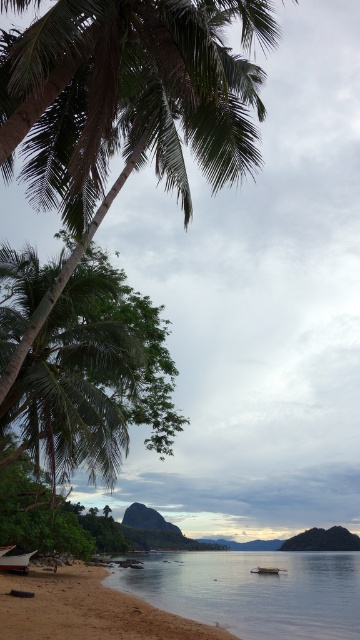
Can you confirm if clear water at lower center is positioned above brown sandy beach at lower left?

No.

What are the coordinates of `clear water at lower center` in the screenshot? It's located at [253, 589].

Locate an element on the screen. clear water at lower center is located at coordinates (253, 589).

Who is positioned more to the left, brown sandy beach at lower left or wooden boat at lower center?

From the viewer's perspective, brown sandy beach at lower left appears more on the left side.

Is the position of brown sandy beach at lower left more distant than that of wooden boat at lower center?

That is False.

Between point (86, 589) and point (267, 570), which one is positioned behind?

The point (267, 570) is more distant.

Find the location of a particular element. The width and height of the screenshot is (360, 640). brown sandy beach at lower left is located at coordinates [87, 609].

From the picture: Is clear water at lower center further to the viewer compared to wooden boat at lower left?

No, clear water at lower center is in front of wooden boat at lower left.

Is clear water at lower center smaller than wooden boat at lower left?

Incorrect, clear water at lower center is not smaller in size than wooden boat at lower left.

You are a GUI agent. You are given a task and a screenshot of the screen. Output one action in this format:
    pyautogui.click(x=<x>, y=<y>)
    Task: Click on the clear water at lower center
    The width and height of the screenshot is (360, 640).
    Given the screenshot: What is the action you would take?
    pyautogui.click(x=253, y=589)